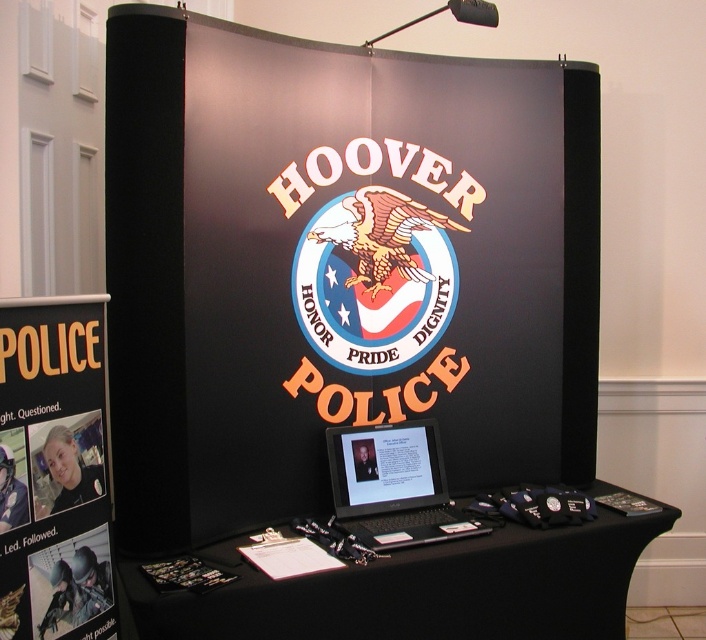
You are a visitor standing in front of the Hoover Police Department promotional booth. You want to read the words on the black matte board at center clearly. Considering the distance between you and the board, can you comfortably read the text from where you are standing?

The black matte board at center is 1.90 meters away from the viewer. At this distance, it may be challenging to read the text clearly without moving closer, as standard reading distance for most people is around 30 cm to 1 meter for small text. However, since the text on the logo, like

You are a police officer standing at the Hoover Police Department booth. You need to place a badge on the black fabric table at lower center. Where exactly should you place it?

The badge should be placed at the coordinates point (418, 589) where the black fabric table at lower center is located.